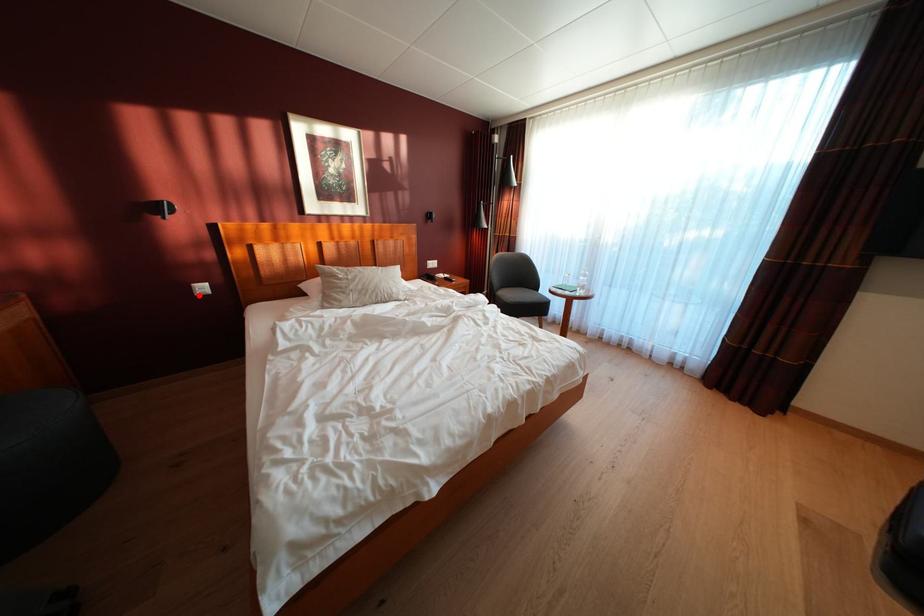
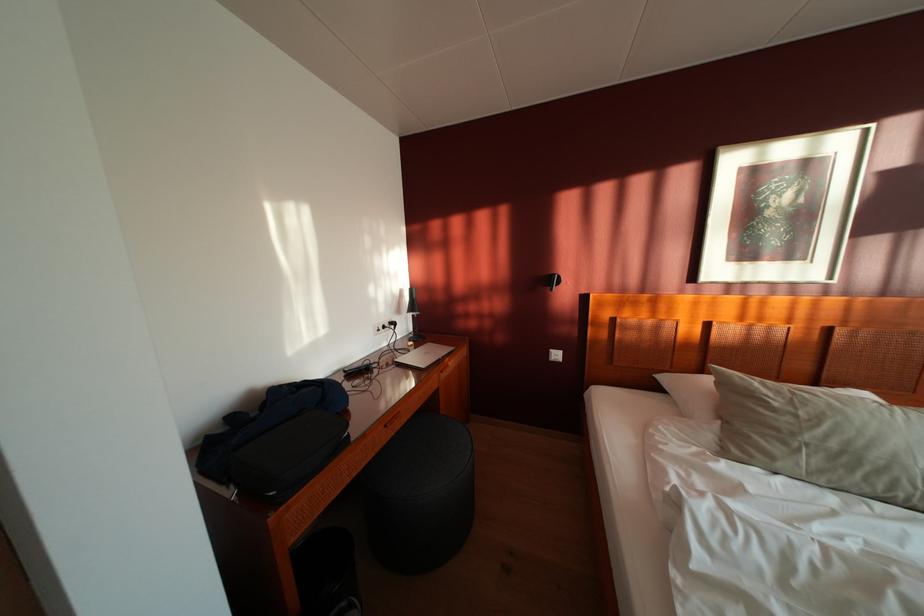
Where in the second image is the point corresponding to the highlighted location from the first image?

(555, 360)